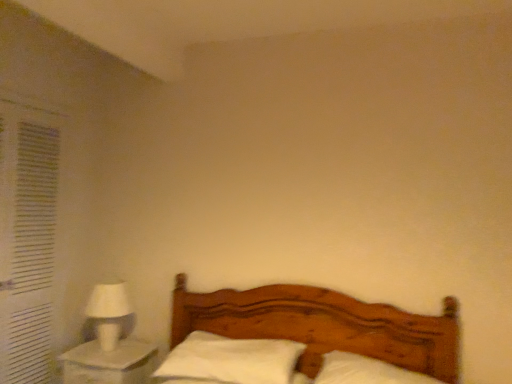
Question: From the image's perspective, is white fabric curtain at left beneath wooden bed at center?

Choices:
 (A) no
 (B) yes

Answer: (A)

Question: From a real-world perspective, is white fabric curtain at left physically above wooden bed at center?

Choices:
 (A) no
 (B) yes

Answer: (B)

Question: Considering the relative sizes of white fabric curtain at left and wooden bed at center in the image provided, is white fabric curtain at left taller than wooden bed at center?

Choices:
 (A) yes
 (B) no

Answer: (A)

Question: Can you confirm if white fabric curtain at left is wider than wooden bed at center?

Choices:
 (A) no
 (B) yes

Answer: (A)

Question: Is white fabric curtain at left next to wooden bed at center?

Choices:
 (A) no
 (B) yes

Answer: (A)

Question: Is point (125, 301) positioned closer to the camera than point (19, 342)?

Choices:
 (A) closer
 (B) farther

Answer: (B)

Question: Relative to white fabric curtain at left, is white matte table lamp at left in front or behind?

Choices:
 (A) front
 (B) behind

Answer: (B)

Question: Based on their sizes in the image, would you say white matte table lamp at left is bigger or smaller than white fabric curtain at left?

Choices:
 (A) small
 (B) big

Answer: (A)

Question: From a real-world perspective, is white matte table lamp at left physically located above or below white fabric curtain at left?

Choices:
 (A) below
 (B) above

Answer: (A)

Question: From a real-world perspective, relative to white soft pillow at center, which ranks as the 2th pillow in right-to-left order, is white glossy nightstand at lower left vertically above or below?

Choices:
 (A) below
 (B) above

Answer: (A)

Question: Based on their positions, is white glossy nightstand at lower left located to the left or right of white soft pillow at center, the first pillow from the left?

Choices:
 (A) right
 (B) left

Answer: (B)

Question: Considering their positions, is white glossy nightstand at lower left located in front of or behind white soft pillow at center, which ranks as the 2th pillow in right-to-left order?

Choices:
 (A) front
 (B) behind

Answer: (B)

Question: Considering the positions of white glossy nightstand at lower left and white soft pillow at center, which ranks as the 2th pillow in right-to-left order, in the image, is white glossy nightstand at lower left wider or thinner than white soft pillow at center, which ranks as the 2th pillow in right-to-left order,?

Choices:
 (A) wide
 (B) thin

Answer: (B)

Question: Considering their positions, is white soft pillow at center, acting as the 2th pillow starting from the left, located in front of or behind white soft pillow at center, which ranks as the 2th pillow in right-to-left order?

Choices:
 (A) behind
 (B) front

Answer: (B)

Question: Is point (332, 357) positioned closer to the camera than point (214, 367)?

Choices:
 (A) closer
 (B) farther

Answer: (B)